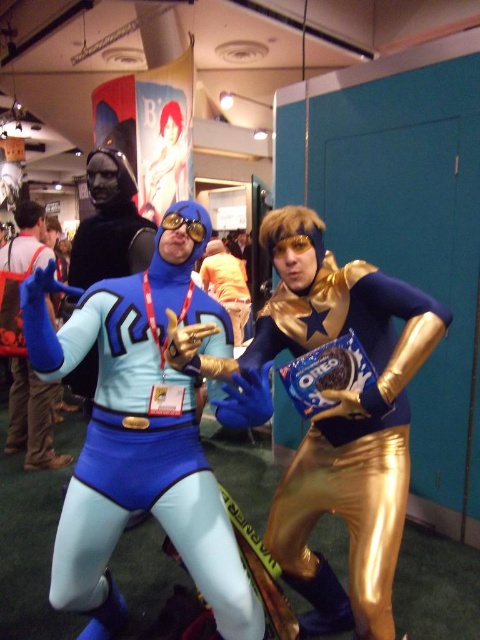
Which is above, matte blue spandex suit at center or gold metallic pants at center?

matte blue spandex suit at center

How much distance is there between matte blue spandex suit at center and gold metallic pants at center?

15.16 inches

Is point (139, 394) farther from viewer compared to point (396, 380)?

Yes, point (139, 394) is behind point (396, 380).

Image resolution: width=480 pixels, height=640 pixels. I want to click on matte blue spandex suit at center, so click(141, 433).

Is gold metallic pants at center positioned behind matte blue suit at center?

No.

Between gold metallic pants at center and matte blue suit at center, which one appears on the left side from the viewer's perspective?

matte blue suit at center is more to the left.

I want to click on gold metallic pants at center, so click(347, 435).

Which of these two, matte blue spandex suit at center or matte blue suit at center, stands shorter?

Standing shorter between the two is matte blue spandex suit at center.

Between point (167, 387) and point (52, 465), which one is positioned behind?

The point (52, 465) is behind.

The width and height of the screenshot is (480, 640). Describe the element at coordinates (141, 433) in the screenshot. I see `matte blue spandex suit at center` at that location.

Where is `matte blue spandex suit at center`? The image size is (480, 640). matte blue spandex suit at center is located at coordinates (141, 433).